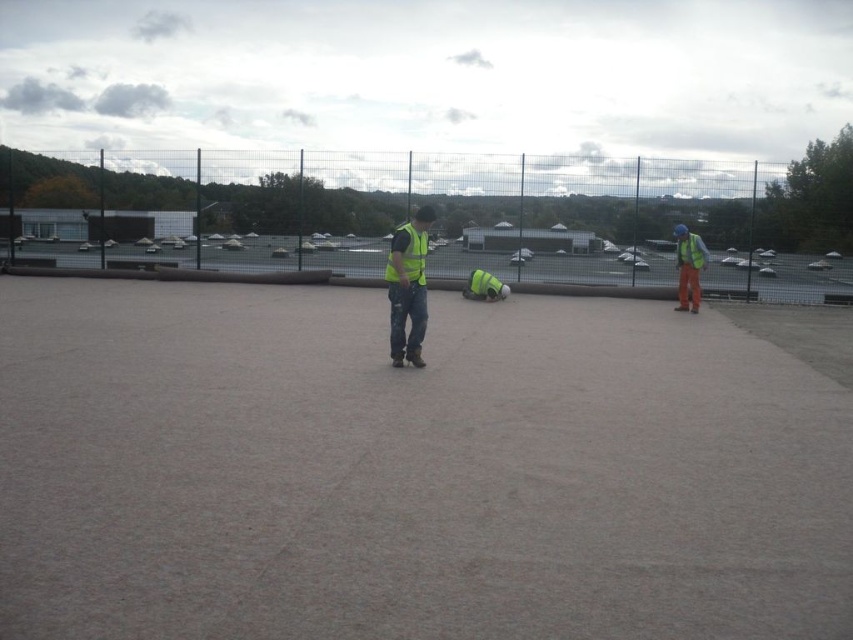
Question: Which point is closer to the camera?

Choices:
 (A) yellow reflective vest at center
 (B) hi-viz reflective jacket at right

Answer: (A)

Question: Does yellow reflective vest at center appear over hi-viz reflective jacket at right?

Choices:
 (A) no
 (B) yes

Answer: (A)

Question: Which of the following is the farthest from the observer?

Choices:
 (A) (694, 241)
 (B) (405, 275)

Answer: (A)

Question: From the image, what is the correct spatial relationship of yellow reflective vest at center in relation to hi-viz reflective jacket at right?

Choices:
 (A) left
 (B) right

Answer: (A)

Question: Where is yellow reflective vest at center located in relation to hi-viz reflective jacket at right in the image?

Choices:
 (A) above
 (B) below

Answer: (B)

Question: Which point is closer to the camera?

Choices:
 (A) yellow reflective vest at center
 (B) hi-viz reflective jacket at right

Answer: (A)